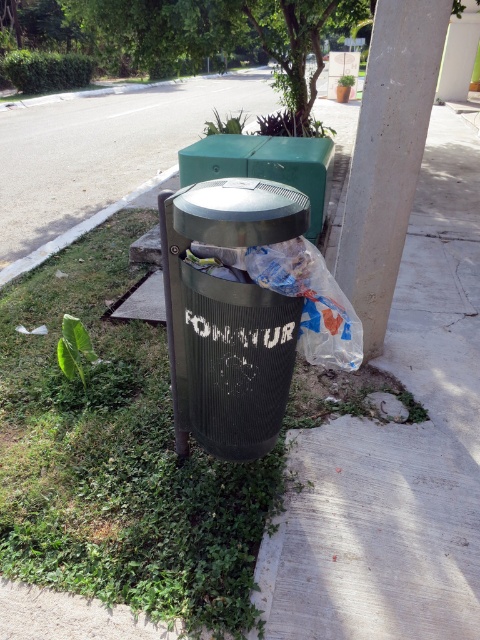
Question: Can you confirm if green grass at lower left is bigger than white concrete pillar at upper right?

Choices:
 (A) yes
 (B) no

Answer: (A)

Question: Which point is farther to the camera?

Choices:
 (A) green grass at lower left
 (B) white concrete pillar at upper right

Answer: (B)

Question: Where is green grass at lower left located in relation to white concrete pillar at upper right in the image?

Choices:
 (A) right
 (B) left

Answer: (B)

Question: Which point appears farthest from the camera in this image?

Choices:
 (A) (159, 349)
 (B) (385, 109)

Answer: (A)

Question: Does green grass at lower left appear under white concrete pillar at upper right?

Choices:
 (A) yes
 (B) no

Answer: (A)

Question: Which point appears farthest from the camera in this image?

Choices:
 (A) (436, 60)
 (B) (245, 467)

Answer: (B)